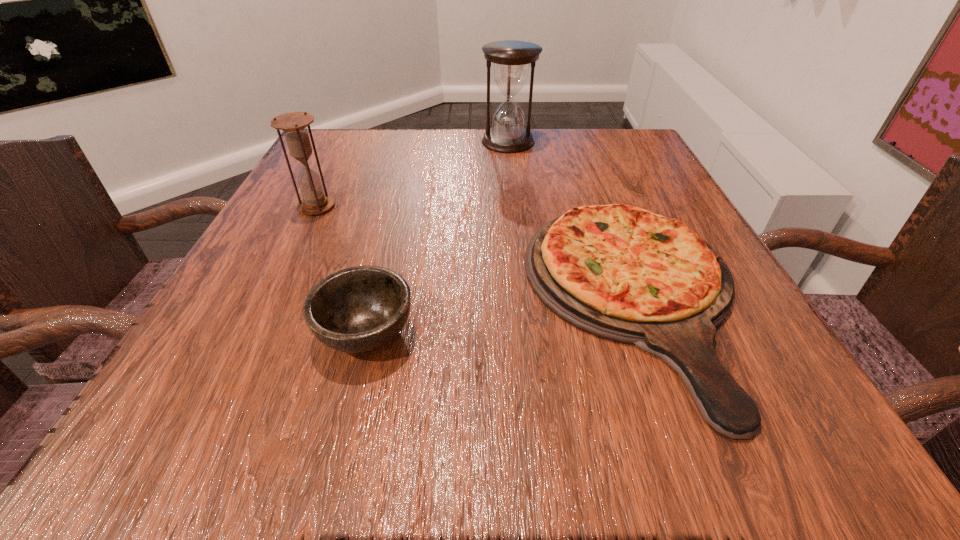
Identify which object is the third nearest to the taller hourglass. Please provide its 2D coordinates. Your answer should be formatted as a tuple, i.e. [(x, y)], where the tuple contains the x and y coordinates of a point satisfying the conditions above.

[(359, 309)]

Choose which object is the nearest neighbor to the third tallest object. Please provide its 2D coordinates. Your answer should be formatted as a tuple, i.e. [(x, y)], where the tuple contains the x and y coordinates of a point satisfying the conditions above.

[(622, 273)]

Identify the location of vacant space that satisfies the following two spatial constraints: 1. on the front side of the third object from right to left; 2. on the right side of the left hourglass. This screenshot has height=540, width=960. (254, 332).

At what (x,y) coordinates should I click in order to perform the action: click on free space that satisfies the following two spatial constraints: 1. on the back side of the bowl; 2. on the right side of the farther hourglass. Please return your answer as a coordinate pair (x, y). Looking at the image, I should click on (414, 141).

You are a GUI agent. You are given a task and a screenshot of the screen. Output one action in this format:
    pyautogui.click(x=<x>, y=<y>)
    Task: Click on the free space that satisfies the following two spatial constraints: 1. on the front side of the right hourglass; 2. on the right side of the shortest object
    The width and height of the screenshot is (960, 540).
    Given the screenshot: What is the action you would take?
    pyautogui.click(x=525, y=299)